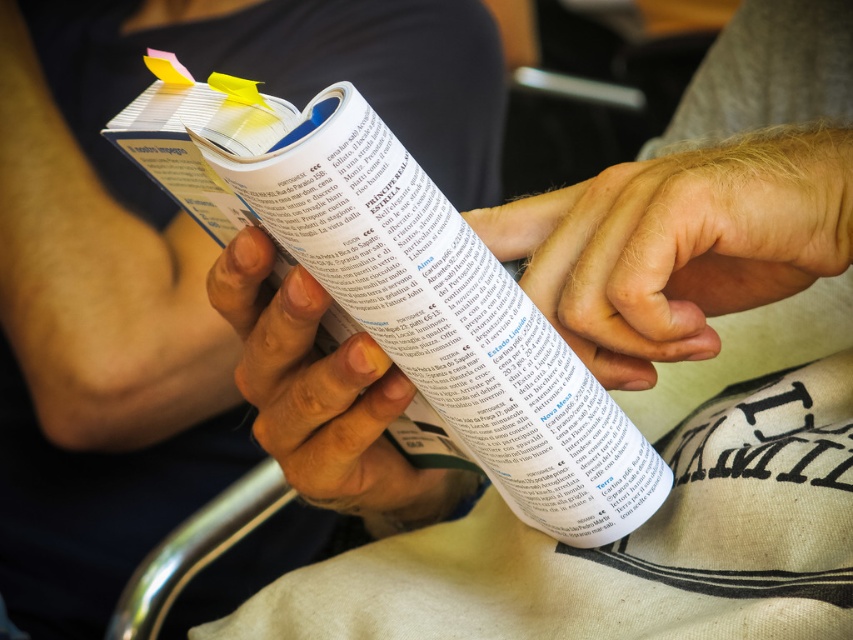
Question: Estimate the real-world distances between objects in this image. Which object is closer to the light skin tone flesh at center?

Choices:
 (A) matte paper book at center
 (B) smooth skin hand at center

Answer: (B)

Question: Where is matte paper book at center located in relation to light skin tone flesh at center in the image?

Choices:
 (A) right
 (B) left

Answer: (B)

Question: Does matte paper book at center appear on the left side of smooth skin hand at center?

Choices:
 (A) no
 (B) yes

Answer: (B)

Question: Which point is closer to the camera taking this photo?

Choices:
 (A) (576, 321)
 (B) (218, 381)
 (C) (236, 241)

Answer: (C)

Question: Does matte paper book at center appear on the left side of light skin tone flesh at center?

Choices:
 (A) yes
 (B) no

Answer: (A)

Question: Among these objects, which one is nearest to the camera?

Choices:
 (A) matte paper book at center
 (B) light skin tone flesh at center
 (C) smooth skin hand at center

Answer: (B)